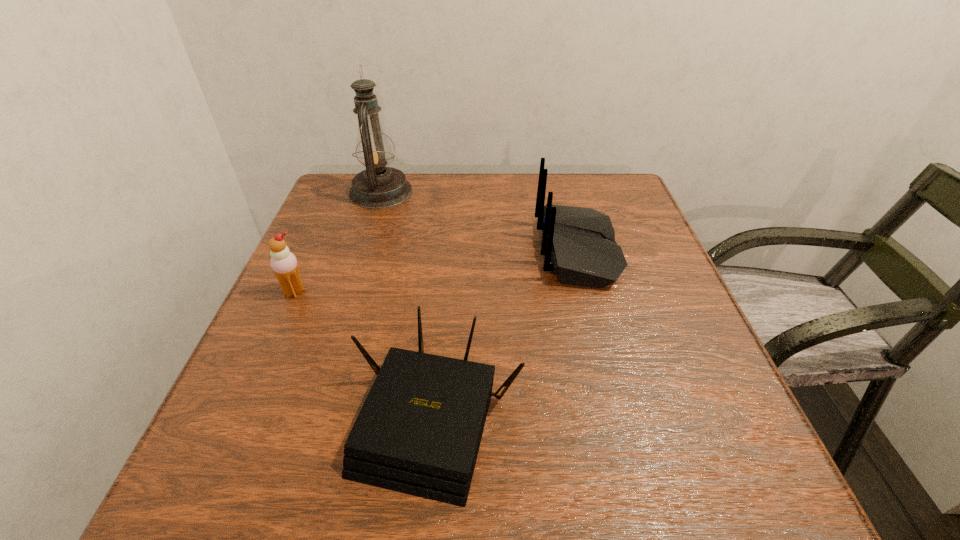
I want to click on unoccupied position between the leftmost object and the tallest object, so click(338, 242).

You are a GUI agent. You are given a task and a screenshot of the screen. Output one action in this format:
    pyautogui.click(x=<x>, y=<y>)
    Task: Click on the empty space between the leftmost object and the rightmost object
    This screenshot has height=540, width=960.
    Given the screenshot: What is the action you would take?
    pyautogui.click(x=436, y=271)

Locate an element on the screen. The height and width of the screenshot is (540, 960). free space between the left router and the tallest object is located at coordinates (409, 305).

Find the location of a particular element. empty space between the rightmost object and the nearer router is located at coordinates (508, 334).

The image size is (960, 540). Find the location of `unoccupied area between the farthest object and the nearest object`. unoccupied area between the farthest object and the nearest object is located at coordinates (409, 305).

The image size is (960, 540). Identify the location of vacant space in between the shorter router and the oil lamp. (409, 305).

I want to click on unoccupied position between the third tallest object and the tallest object, so click(x=338, y=242).

In order to click on unoccupied position between the farthest object and the taller router in this screenshot , I will do `click(479, 221)`.

At what (x,y) coordinates should I click in order to perform the action: click on vacant space that's between the oil lamp and the third tallest object. Please return your answer as a coordinate pair (x, y). This screenshot has width=960, height=540. Looking at the image, I should click on (338, 242).

Locate an element on the screen. The width and height of the screenshot is (960, 540). free space between the right router and the leftmost object is located at coordinates (436, 271).